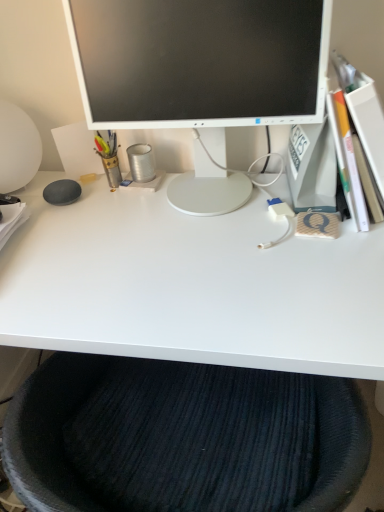
Locate an element on the screen. The width and height of the screenshot is (384, 512). metallic canister at center, which is the first stationery in right-to-left order is located at coordinates (141, 162).

In order to face white glossy desk at center, should I rotate leftwards or rightwards?

A 2.000 degree turn to the left will do.

What do you see at coordinates (191, 285) in the screenshot? This screenshot has height=512, width=384. I see `white glossy desk at center` at bounding box center [191, 285].

Identify the location of metallic pen holder at left, which appears as the second stationery when viewed from the right. (x=109, y=156).

Does metallic canister at center, the second stationery in the left-to-right sequence, lie in front of metallic pen holder at left, which appears as the second stationery when viewed from the right?

No, metallic canister at center, the second stationery in the left-to-right sequence, is further to the viewer.

Is metallic canister at center, which is the first stationery in right-to-left order, inside or outside of metallic pen holder at left, which is the first stationery from left to right?

The correct answer is: outside.

Could you measure the distance between metallic canister at center, the second stationery in the left-to-right sequence, and metallic pen holder at left, which is the first stationery from left to right?

The distance of metallic canister at center, the second stationery in the left-to-right sequence, from metallic pen holder at left, which is the first stationery from left to right, is 6.67 centimeters.

Does point (135, 173) come in front of point (110, 166)?

Yes, point (135, 173) is closer to viewer.

From the image's perspective, between dark blue textured cushion at lower center and white glossy monitor at center, who is located below?

From the image's view, dark blue textured cushion at lower center is below.

Is dark blue textured cushion at lower center facing away from white glossy monitor at center?

That's not correct — dark blue textured cushion at lower center is not looking away from white glossy monitor at center.

Could white glossy monitor at center be considered to be inside dark blue textured cushion at lower center?

Actually, white glossy monitor at center is outside dark blue textured cushion at lower center.

Considering the relative sizes of white glossy monitor at center and metallic canister at center, which is the first stationery in right-to-left order, in the image provided, is white glossy monitor at center bigger than metallic canister at center, which is the first stationery in right-to-left order,?

Yes.

From a real-world perspective, is white glossy monitor at center beneath metallic canister at center, which is the first stationery in right-to-left order?

No, from a real-world perspective, white glossy monitor at center is not below metallic canister at center, which is the first stationery in right-to-left order.

Would you consider white glossy monitor at center to be distant from metallic canister at center, which is the first stationery in right-to-left order?

They are positioned close to each other.

Is dark blue textured cushion at lower center directly adjacent to white glossy desk at center?

No, dark blue textured cushion at lower center is not with white glossy desk at center.

Where is `computer chair that is under the white glossy desk at center (from a real-world perspective)`? The height and width of the screenshot is (512, 384). computer chair that is under the white glossy desk at center (from a real-world perspective) is located at coordinates (180, 438).

Can you confirm if dark blue textured cushion at lower center is positioned to the left of white glossy desk at center?

No, dark blue textured cushion at lower center is not to the left of white glossy desk at center.

Is white glossy desk at center surrounded by dark blue textured cushion at lower center?

That's incorrect, white glossy desk at center is not inside dark blue textured cushion at lower center.

Who is bigger, white glossy desk at center or metallic pen holder at left, which appears as the second stationery when viewed from the right?

With larger size is white glossy desk at center.

Can you tell me how much white glossy desk at center and metallic pen holder at left, which is the first stationery from left to right, differ in facing direction?

0.812 degrees.

Which is more to the right, white glossy desk at center or metallic pen holder at left, which appears as the second stationery when viewed from the right?

white glossy desk at center is more to the right.

Could metallic pen holder at left, which is the first stationery from left to right, be considered to be inside white glossy desk at center?

Definitely not — metallic pen holder at left, which is the first stationery from left to right, is not inside white glossy desk at center.

Considering the relative sizes of white glossy monitor at center and metallic pen holder at left, which appears as the second stationery when viewed from the right, in the image provided, is white glossy monitor at center taller than metallic pen holder at left, which appears as the second stationery when viewed from the right,?

Indeed, white glossy monitor at center has a greater height compared to metallic pen holder at left, which appears as the second stationery when viewed from the right.

Can metallic pen holder at left, which is the first stationery from left to right, be found inside white glossy monitor at center?

Actually, metallic pen holder at left, which is the first stationery from left to right, is outside white glossy monitor at center.

From the image's perspective, between white glossy monitor at center and metallic pen holder at left, which appears as the second stationery when viewed from the right, who is located below?

metallic pen holder at left, which appears as the second stationery when viewed from the right, is shown below in the image.

Is white glossy desk at center looking in the opposite direction of white glossy monitor at center?

No, white glossy monitor at center is not at the back of white glossy desk at center.

Where is `computer monitor located above the white glossy desk at center (from a real-world perspective)`? The image size is (384, 512). computer monitor located above the white glossy desk at center (from a real-world perspective) is located at coordinates (200, 61).

From a real-world perspective, is white glossy desk at center physically above white glossy monitor at center?

No.

Where is `stationery below the metallic canister at center, which is the first stationery in right-to-left order (from the image's perspective)`? The width and height of the screenshot is (384, 512). stationery below the metallic canister at center, which is the first stationery in right-to-left order (from the image's perspective) is located at coordinates (109, 156).

Where is `computer monitor above the dark blue textured cushion at lower center (from the image's perspective)`? computer monitor above the dark blue textured cushion at lower center (from the image's perspective) is located at coordinates (200, 61).

In the scene shown: From the image, which object appears to be nearer to white glossy desk at center, white glossy monitor at center or metallic pen holder at left, which appears as the second stationery when viewed from the right?

white glossy monitor at center.

Considering their positions, is metallic canister at center, which is the first stationery in right-to-left order, positioned further to metallic pen holder at left, which is the first stationery from left to right, than dark blue textured cushion at lower center?

Among the two, dark blue textured cushion at lower center is located further to metallic pen holder at left, which is the first stationery from left to right.

From the picture: Estimate the real-world distances between objects in this image. Which object is closer to white glossy monitor at center, white glossy desk at center or metallic pen holder at left, which appears as the second stationery when viewed from the right?

The object closer to white glossy monitor at center is white glossy desk at center.

Based on their spatial positions, is metallic pen holder at left, which appears as the second stationery when viewed from the right, or metallic canister at center, which is the first stationery in right-to-left order, closer to dark blue textured cushion at lower center?

metallic canister at center, which is the first stationery in right-to-left order.

Estimate the real-world distances between objects in this image. Which object is further from metallic pen holder at left, which is the first stationery from left to right, white glossy desk at center or metallic canister at center, the second stationery in the left-to-right sequence?

white glossy desk at center lies further to metallic pen holder at left, which is the first stationery from left to right, than the other object.

Which object lies nearer to the anchor point dark blue textured cushion at lower center, metallic canister at center, the second stationery in the left-to-right sequence, or metallic pen holder at left, which appears as the second stationery when viewed from the right?

metallic canister at center, the second stationery in the left-to-right sequence, lies closer to dark blue textured cushion at lower center than the other object.

When comparing their distances from metallic pen holder at left, which is the first stationery from left to right, does white glossy monitor at center or white glossy desk at center seem further?

white glossy desk at center is positioned further to the anchor metallic pen holder at left, which is the first stationery from left to right.

Which object lies nearer to the anchor point white glossy monitor at center, metallic pen holder at left, which appears as the second stationery when viewed from the right, or metallic canister at center, which is the first stationery in right-to-left order?

metallic canister at center, which is the first stationery in right-to-left order, is closer to white glossy monitor at center.

This screenshot has height=512, width=384. I want to click on desk that lies between metallic canister at center, the second stationery in the left-to-right sequence, and dark blue textured cushion at lower center from top to bottom, so click(191, 285).

At what (x,y) coordinates should I click in order to perform the action: click on stationery between metallic canister at center, which is the first stationery in right-to-left order, and white glossy desk at center in the up-down direction. Please return your answer as a coordinate pair (x, y). The width and height of the screenshot is (384, 512). Looking at the image, I should click on point(109,156).

Where is `stationery between white glossy monitor at center and metallic canister at center, which is the first stationery in right-to-left order, in the front-back direction`? stationery between white glossy monitor at center and metallic canister at center, which is the first stationery in right-to-left order, in the front-back direction is located at coordinates (109, 156).

Locate an element on the screen. The height and width of the screenshot is (512, 384). stationery between metallic canister at center, the second stationery in the left-to-right sequence, and dark blue textured cushion at lower center vertically is located at coordinates pos(109,156).